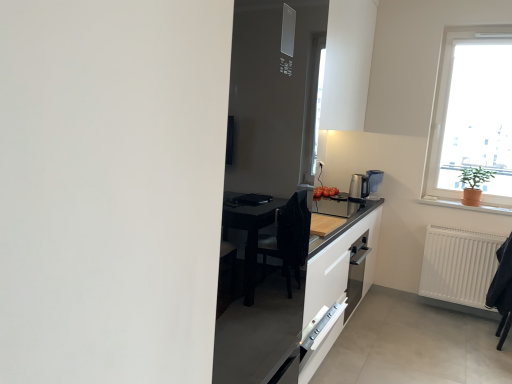
Question: From the image's perspective, is orange clay pot at right beneath satin silver coffee machine at right?

Choices:
 (A) no
 (B) yes

Answer: (B)

Question: Is orange clay pot at right positioned with its back to satin silver coffee machine at right?

Choices:
 (A) no
 (B) yes

Answer: (A)

Question: Is orange clay pot at right at the right side of satin silver coffee machine at right?

Choices:
 (A) yes
 (B) no

Answer: (A)

Question: Can we say orange clay pot at right lies outside satin silver coffee machine at right?

Choices:
 (A) no
 (B) yes

Answer: (B)

Question: Is there a large distance between orange clay pot at right and satin silver coffee machine at right?

Choices:
 (A) yes
 (B) no

Answer: (B)

Question: Would you say white glass window at upper right is to the left or to the right of satin silver coffee machine at right in the picture?

Choices:
 (A) right
 (B) left

Answer: (A)

Question: Is point (477, 81) closer or farther from the camera than point (352, 190)?

Choices:
 (A) closer
 (B) farther

Answer: (A)

Question: Is white glass window at upper right situated inside satin silver coffee machine at right or outside?

Choices:
 (A) outside
 (B) inside

Answer: (A)

Question: In terms of width, does white glass window at upper right look wider or thinner when compared to satin silver coffee machine at right?

Choices:
 (A) thin
 (B) wide

Answer: (B)

Question: Considering the positions of satin silver coffee machine at right and white glass window at upper right in the image, is satin silver coffee machine at right wider or thinner than white glass window at upper right?

Choices:
 (A) thin
 (B) wide

Answer: (A)

Question: Is point (361, 175) positioned closer to the camera than point (501, 193)?

Choices:
 (A) farther
 (B) closer

Answer: (A)

Question: Do you think satin silver coffee machine at right is within white glass window at upper right, or outside of it?

Choices:
 (A) outside
 (B) inside

Answer: (A)

Question: From their relative heights in the image, would you say satin silver coffee machine at right is taller or shorter than white glass window at upper right?

Choices:
 (A) short
 (B) tall

Answer: (A)

Question: Considering the positions of white plastic electric outlet at upper center and satin silver coffee machine at right in the image, is white plastic electric outlet at upper center bigger or smaller than satin silver coffee machine at right?

Choices:
 (A) big
 (B) small

Answer: (B)

Question: Which is correct: white plastic electric outlet at upper center is inside satin silver coffee machine at right, or outside of it?

Choices:
 (A) outside
 (B) inside

Answer: (A)